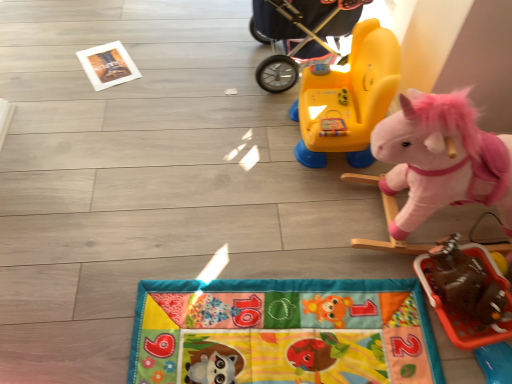
Question: Does yellow plastic rocker at upper center, which appears as the 1th toy when viewed from the top, come behind yellow plastic baby carriage at upper center?

Choices:
 (A) no
 (B) yes

Answer: (A)

Question: Can you confirm if yellow plastic rocker at upper center, which appears as the 1th toy when viewed from the top, is shorter than yellow plastic baby carriage at upper center?

Choices:
 (A) no
 (B) yes

Answer: (B)

Question: Is yellow plastic rocker at upper center, which appears as the 1th toy when viewed from the top, looking in the opposite direction of yellow plastic baby carriage at upper center?

Choices:
 (A) yes
 (B) no

Answer: (B)

Question: Is yellow plastic baby carriage at upper center inside yellow plastic rocker at upper center, the 3th toy when ordered from bottom to top?

Choices:
 (A) yes
 (B) no

Answer: (B)

Question: From the image's perspective, is yellow plastic rocker at upper center, the 3th toy when ordered from bottom to top, over yellow plastic baby carriage at upper center?

Choices:
 (A) no
 (B) yes

Answer: (A)

Question: From the image's perspective, relative to brown fuzzy elephant at lower right, which is the third toy from top to bottom, is yellow plastic baby carriage at upper center above or below?

Choices:
 (A) below
 (B) above

Answer: (B)

Question: Is point (295, 21) closer or farther from the camera than point (429, 268)?

Choices:
 (A) closer
 (B) farther

Answer: (B)

Question: From their relative heights in the image, would you say yellow plastic baby carriage at upper center is taller or shorter than brown fuzzy elephant at lower right, which is the third toy from top to bottom?

Choices:
 (A) short
 (B) tall

Answer: (B)

Question: From a real-world perspective, relative to brown fuzzy elephant at lower right, positioned as the first toy in bottom-to-top order, is yellow plastic baby carriage at upper center vertically above or below?

Choices:
 (A) above
 (B) below

Answer: (A)

Question: Relative to brown fuzzy elephant at lower right, which is the third toy from top to bottom, is pink plush unicorn at right, marked as the 2th toy in a bottom-to-top arrangement, in front or behind?

Choices:
 (A) front
 (B) behind

Answer: (A)

Question: From the image's perspective, is pink plush unicorn at right, positioned as the 2th toy in top-to-bottom order, located above or below brown fuzzy elephant at lower right, positioned as the first toy in bottom-to-top order?

Choices:
 (A) above
 (B) below

Answer: (A)

Question: Do you think pink plush unicorn at right, marked as the 2th toy in a bottom-to-top arrangement, is within brown fuzzy elephant at lower right, positioned as the first toy in bottom-to-top order, or outside of it?

Choices:
 (A) outside
 (B) inside

Answer: (A)

Question: From a real-world perspective, relative to brown fuzzy elephant at lower right, positioned as the first toy in bottom-to-top order, is pink plush unicorn at right, positioned as the 2th toy in top-to-bottom order, vertically above or below?

Choices:
 (A) below
 (B) above

Answer: (B)

Question: From a real-world perspective, is yellow plastic baby carriage at upper center positioned above or below pink plush unicorn at right, positioned as the 2th toy in top-to-bottom order?

Choices:
 (A) below
 (B) above

Answer: (A)

Question: From their relative heights in the image, would you say yellow plastic baby carriage at upper center is taller or shorter than pink plush unicorn at right, positioned as the 2th toy in top-to-bottom order?

Choices:
 (A) tall
 (B) short

Answer: (B)